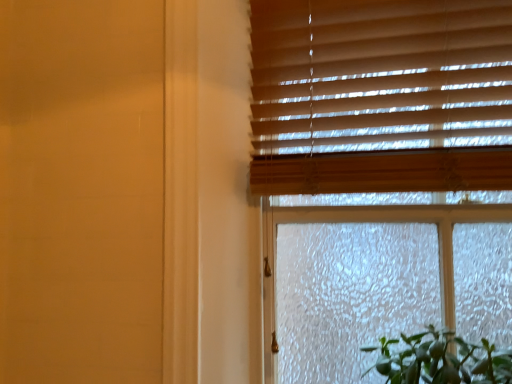
Question: Is wooden blinds at upper right wider than wooden blinds at upper right?

Choices:
 (A) no
 (B) yes

Answer: (B)

Question: Is wooden blinds at upper right outside wooden blinds at upper right?

Choices:
 (A) no
 (B) yes

Answer: (B)

Question: Can you see wooden blinds at upper right touching wooden blinds at upper right?

Choices:
 (A) no
 (B) yes

Answer: (B)

Question: Is wooden blinds at upper right shorter than wooden blinds at upper right?

Choices:
 (A) yes
 (B) no

Answer: (B)

Question: Is wooden blinds at upper right looking in the opposite direction of wooden blinds at upper right?

Choices:
 (A) no
 (B) yes

Answer: (B)

Question: Is wooden blinds at upper right to the left of wooden blinds at upper right from the viewer's perspective?

Choices:
 (A) no
 (B) yes

Answer: (B)

Question: Considering the relative sizes of wooden blinds at upper right and wooden blinds at upper right in the image provided, is wooden blinds at upper right bigger than wooden blinds at upper right?

Choices:
 (A) no
 (B) yes

Answer: (A)

Question: From a real-world perspective, does wooden blinds at upper right sit lower than wooden blinds at upper right?

Choices:
 (A) no
 (B) yes

Answer: (A)

Question: From a real-world perspective, is wooden blinds at upper right physically above wooden blinds at upper right?

Choices:
 (A) yes
 (B) no

Answer: (A)

Question: Is wooden blinds at upper right thinner than wooden blinds at upper right?

Choices:
 (A) yes
 (B) no

Answer: (A)

Question: Can you confirm if wooden blinds at upper right is smaller than wooden blinds at upper right?

Choices:
 (A) yes
 (B) no

Answer: (A)

Question: Is there a large distance between wooden blinds at upper right and wooden blinds at upper right?

Choices:
 (A) yes
 (B) no

Answer: (B)

Question: From the image's perspective, is wooden blinds at upper right located above or below wooden blinds at upper right?

Choices:
 (A) above
 (B) below

Answer: (A)